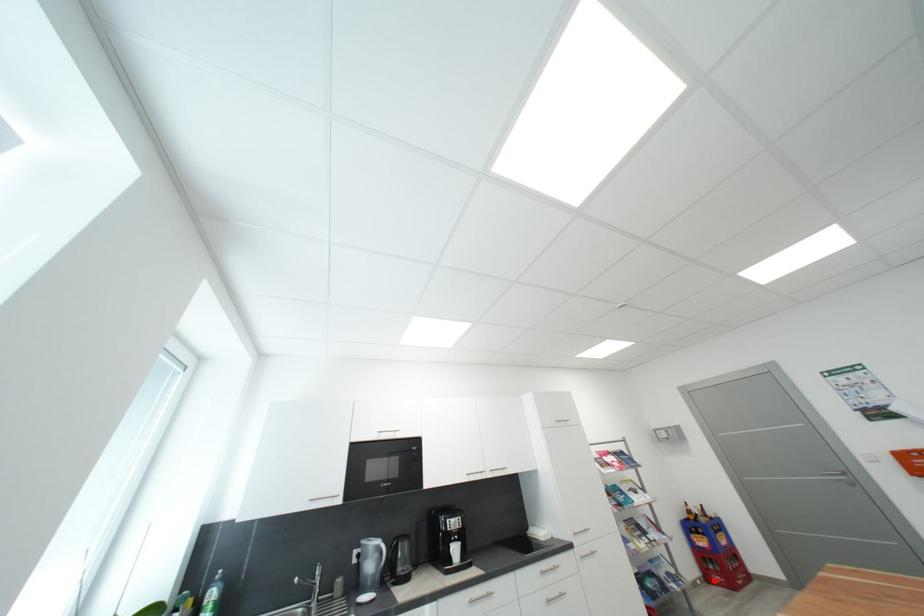
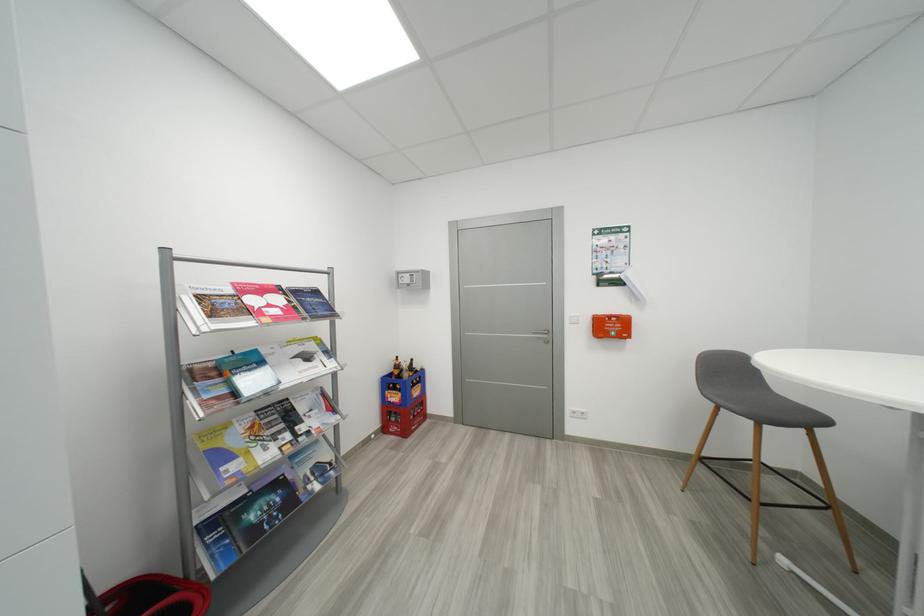
In the second image, find the point that corresponds to the highlighted location in the first image.

(392, 431)